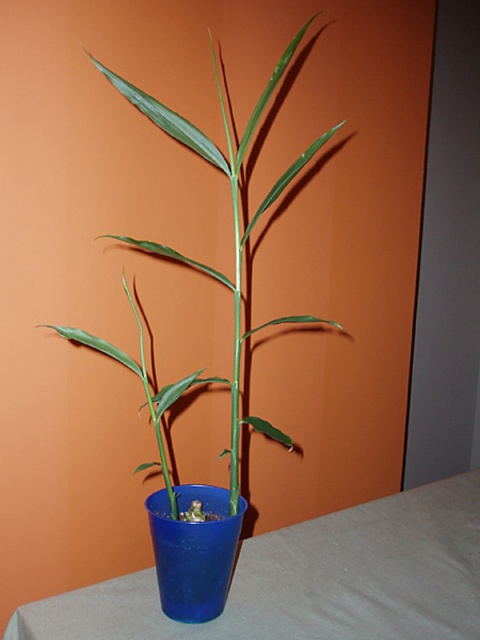
You are placing a small decorative item on the blue plastic table at center. Considering the height of the green glossy plant at center, will the item be visible from above the plant?

The blue plastic table at center is shorter than the green glossy plant at center, so placing the item on the table may not make it fully visible from above the plant unless positioned strategically.

You are organizing a small indoor garden and want to place a decorative item between the blue plastic table at center and the green glossy plant at center. Considering their widths, which object should the decorative item be placed closer to?

The blue plastic table at center is wider than the green glossy plant at center. Therefore, the decorative item should be placed closer to the green glossy plant at center to maintain balance between their widths.

You have a small decorative item that is 10 cm wide. You want to place it next to the green glossy plant at center and the blue plastic cup at center on the light gray cloth. Based on their widths, which object can the decorative item fit next to without overlapping?

The green glossy plant at center is wider than the blue plastic cup at center. Since the decorative item is 10 cm wide, it can fit next to the blue plastic cup at center as there is more space available compared to the wider plant.